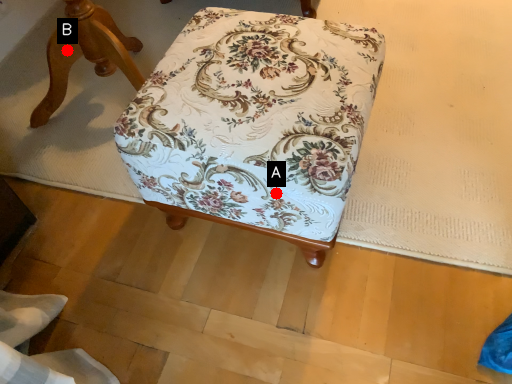
Question: Two points are circled on the image, labeled by A and B beside each circle. Among these points, which one is farthest from the camera?

Choices:
 (A) A is further
 (B) B is further

Answer: (B)